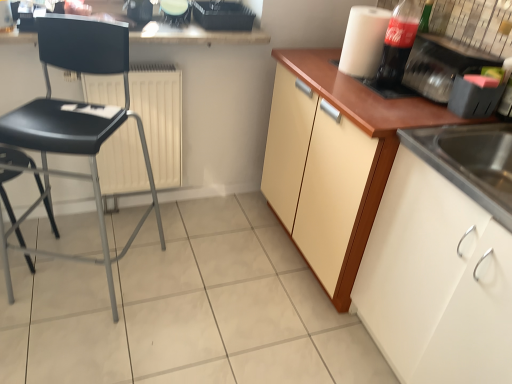
You are a GUI agent. You are given a task and a screenshot of the screen. Output one action in this format:
    pyautogui.click(x=<x>, y=<y>)
    Task: Click on the vacant region to the left of metallic silver toaster at upper right, the 3th appliance positioned from the left
    The width and height of the screenshot is (512, 384).
    Given the screenshot: What is the action you would take?
    pyautogui.click(x=348, y=87)